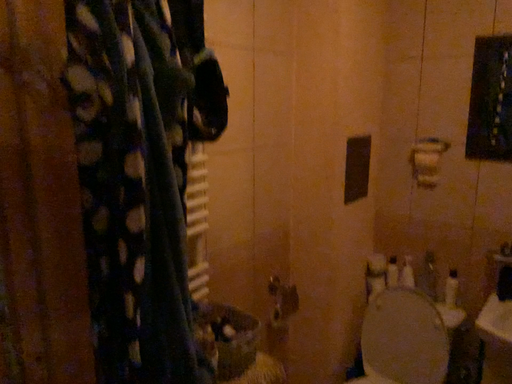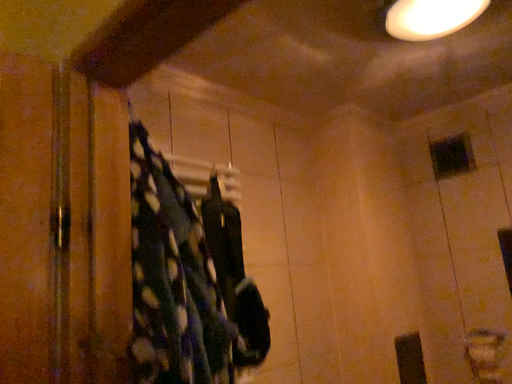
Question: Which way did the camera rotate in the video?

Choices:
 (A) rotated downward
 (B) rotated upward

Answer: (B)